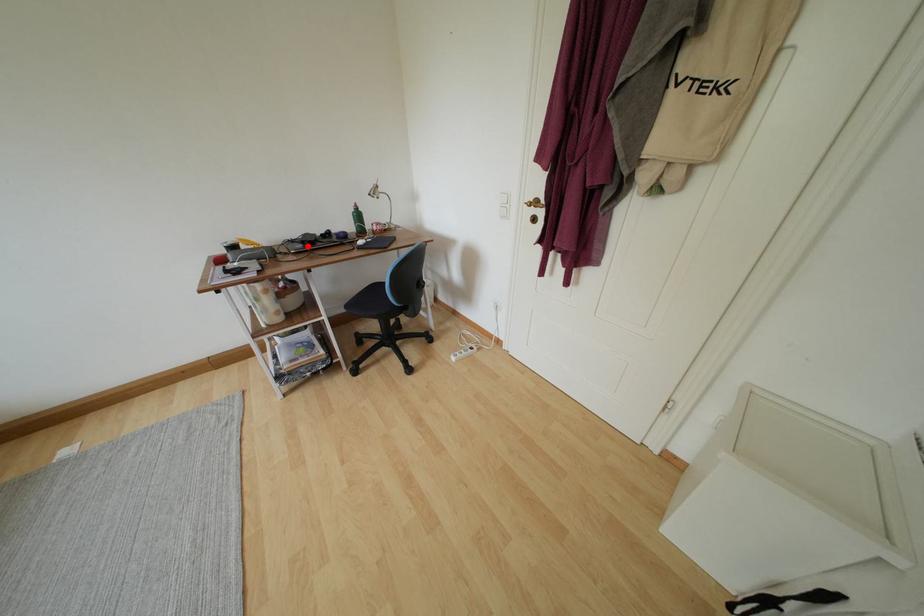
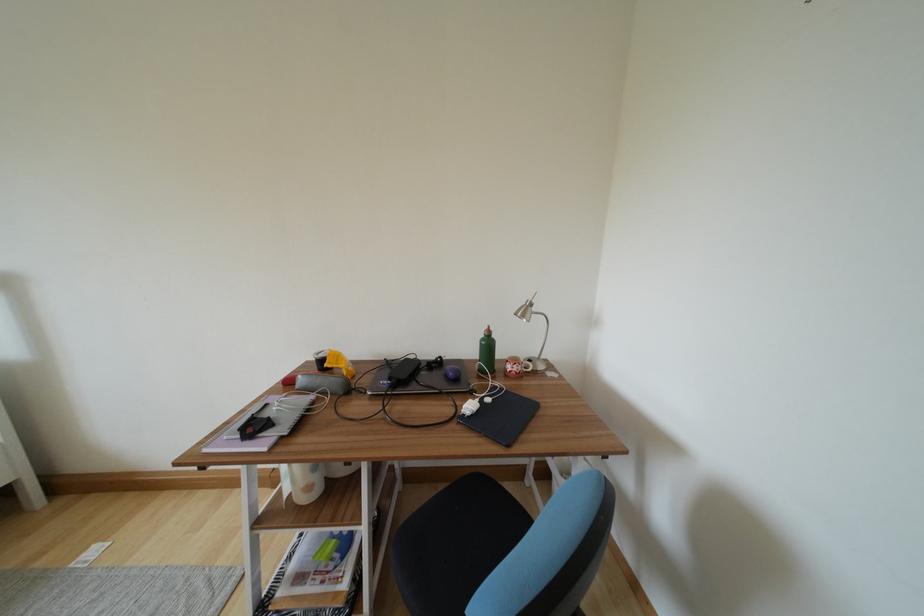
Where in the second image is the point corresponding to the highlighted location from the first image?

(395, 382)